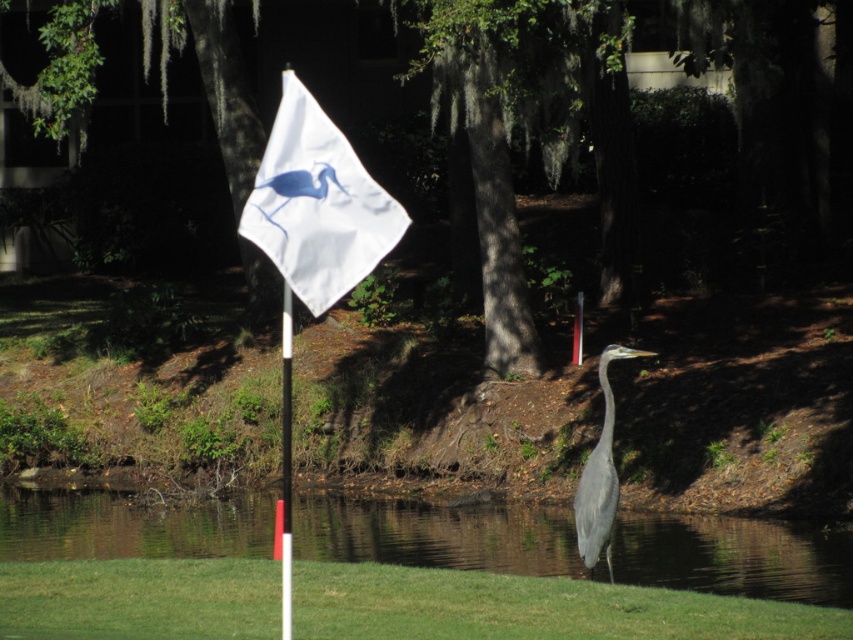
You are a golfer trying to aim your shot towards the hole marked by the white plastic flag pole at center. There is transparent water at lower center in your path. According to the scene description, is the water to the left or right of the flag pole?

The transparent water at lower center is to the right of the white plastic flag pole at center, so the water is on the right side of the flag pole.

You are a golfer standing on the green grass at lower right and want to hit a ball to the white flag with a blue heron logo. Considering the transparent water at lower center is between you and the flag, will the water interfere with your shot?

The transparent water at lower center is further to the viewer than green grass at lower right, meaning the water is closer to your position. Since the water is between you and the flag, it will interfere with your shot.